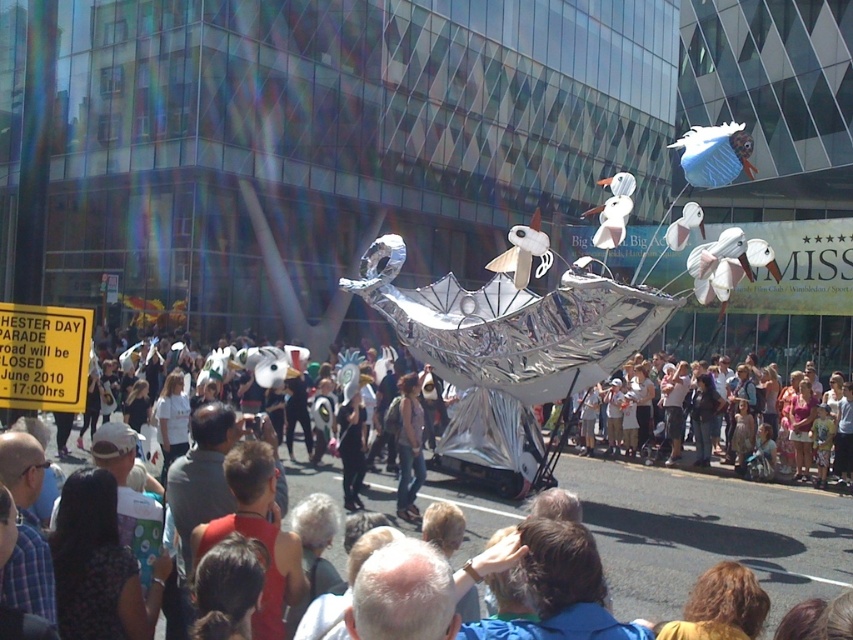
Question: Can you confirm if reflective silver umbrella at center is positioned above white cotton crowd at lower right?

Choices:
 (A) no
 (B) yes

Answer: (A)

Question: Can you confirm if reflective silver umbrella at center is thinner than white cotton crowd at lower right?

Choices:
 (A) yes
 (B) no

Answer: (B)

Question: Which object appears closest to the camera in this image?

Choices:
 (A) white cotton crowd at lower right
 (B) reflective silver umbrella at center

Answer: (B)

Question: Does reflective silver umbrella at center appear under white cotton crowd at lower right?

Choices:
 (A) yes
 (B) no

Answer: (A)